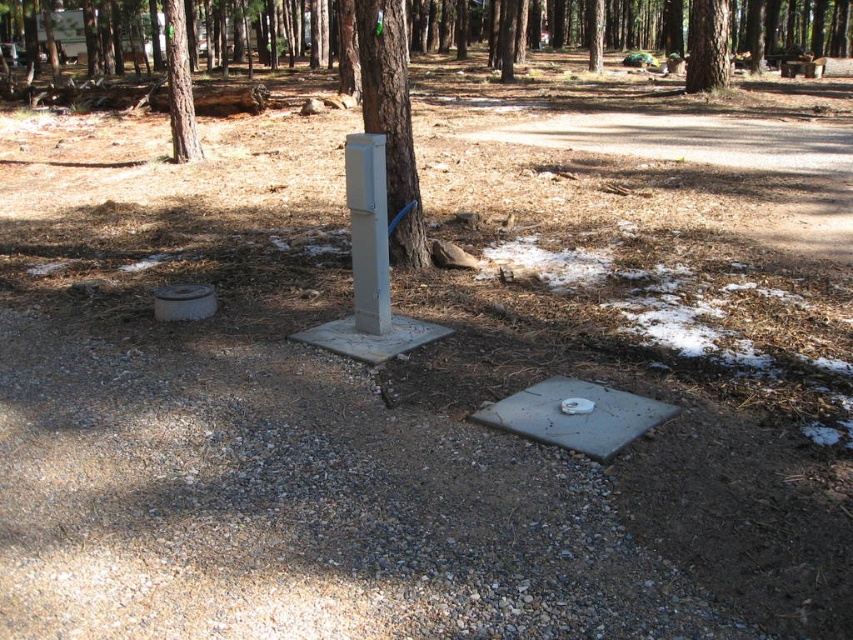
You are a maintenance worker needing to access both the gray metallic utility box at center and the gray matte utility box at center. Which one is located to the right of the other?

The gray metallic utility box at center is positioned on the right side of the gray matte utility box at center.

You are a maintenance worker needing to reach the gray metallic utility box at center from the brown rough tree at upper left. Given that your tool bag can only carry enough supplies for a 15 foot journey, will you have enough supplies to reach the utility box?

The gray metallic utility box at center and brown rough tree at upper left are 18.58 feet apart from each other. Since your tool bag only supports a 15 foot journey, you do not have enough supplies to reach the utility box.

You are a maintenance worker needing to access the gray metallic utility box at center. The brown textured tree at upper center is blocking your path. Can you walk around the tree to reach the utility box?

The gray metallic utility box at center is shorter than the brown textured tree at upper center, so the tree might block the path. However, since the utility box is at ground level and the tree is taller, you can likely walk around the tree to reach the utility box as the height difference doesn